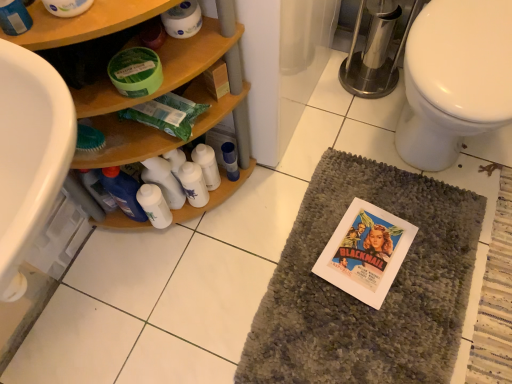
Where is `free point in front of white glossy bottles at center, the second toiletry in the left-to-right sequence`? free point in front of white glossy bottles at center, the second toiletry in the left-to-right sequence is located at coordinates (203, 253).